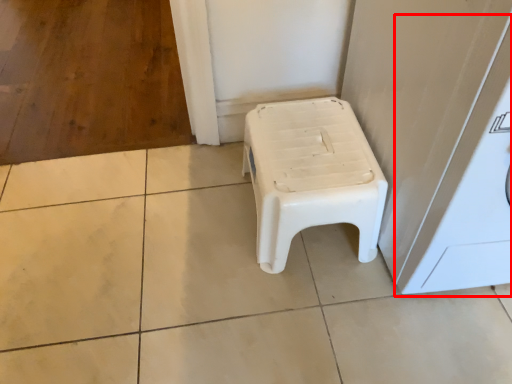
Question: From the image's perspective, what is the correct spatial positioning of washing machine (annotated by the red box) in reference to stool?

Choices:
 (A) below
 (B) above

Answer: (B)